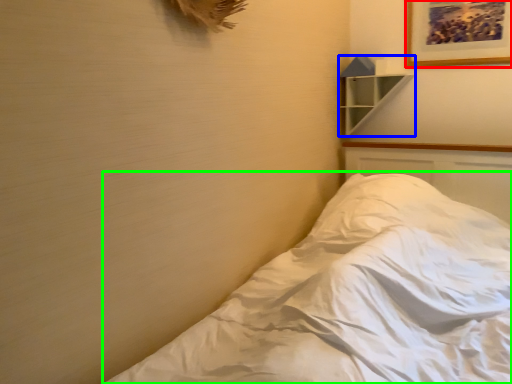
Question: Which is farther away from picture frame (highlighted by a red box)? shelf (highlighted by a blue box) or bed (highlighted by a green box)?

Choices:
 (A) shelf
 (B) bed

Answer: (B)